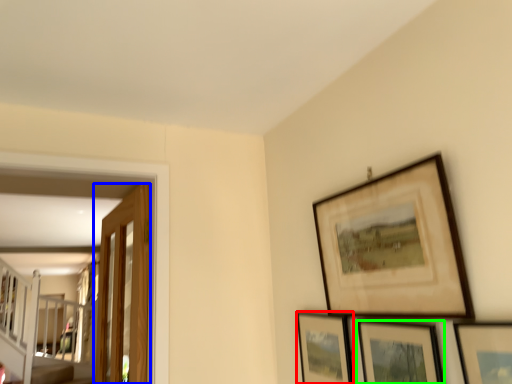
Question: Based on their relative distances, which object is farther from picture frame (highlighted by a red box)? Choose from door (highlighted by a blue box) and picture frame (highlighted by a green box).

Choices:
 (A) door
 (B) picture frame

Answer: (A)